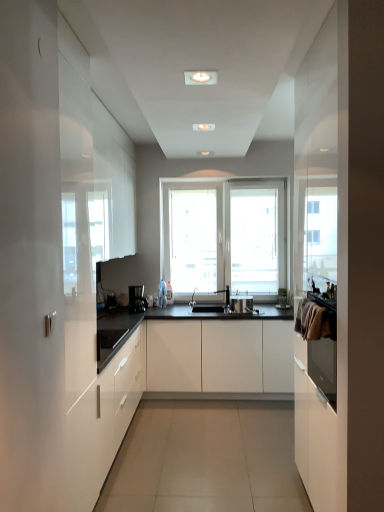
Question: Does satin silver toaster at center appear on the right side of white glossy cabinet at left, marked as the second cabinetry in a right-to-left arrangement?

Choices:
 (A) no
 (B) yes

Answer: (B)

Question: Would you say white glossy cabinet at left, the 1th cabinetry in the left-to-right sequence, is part of satin silver toaster at center's contents?

Choices:
 (A) yes
 (B) no

Answer: (B)

Question: Can you confirm if satin silver toaster at center is taller than white glossy cabinet at left, marked as the second cabinetry in a right-to-left arrangement?

Choices:
 (A) no
 (B) yes

Answer: (A)

Question: Does satin silver toaster at center have a lesser width compared to white glossy cabinet at left, the 1th cabinetry in the left-to-right sequence?

Choices:
 (A) no
 (B) yes

Answer: (B)

Question: Is satin silver toaster at center oriented away from white glossy cabinet at left, marked as the second cabinetry in a right-to-left arrangement?

Choices:
 (A) no
 (B) yes

Answer: (A)

Question: Based on their sizes in the image, would you say white glossy cabinet at left, the 1th cabinetry in the left-to-right sequence, is bigger or smaller than black plastic coffee machine at center?

Choices:
 (A) small
 (B) big

Answer: (B)

Question: Considering the positions of point (84, 398) and point (132, 296), is point (84, 398) closer or farther from the camera than point (132, 296)?

Choices:
 (A) closer
 (B) farther

Answer: (A)

Question: Looking at their shapes, would you say white glossy cabinet at left, marked as the second cabinetry in a right-to-left arrangement, is wider or thinner than black plastic coffee machine at center?

Choices:
 (A) thin
 (B) wide

Answer: (B)

Question: Choose the correct answer: Is white glossy cabinet at left, marked as the second cabinetry in a right-to-left arrangement, inside black plastic coffee machine at center or outside it?

Choices:
 (A) inside
 (B) outside

Answer: (B)

Question: Is satin silver toaster at center situated inside black plastic coffee machine at center or outside?

Choices:
 (A) outside
 (B) inside

Answer: (A)

Question: Considering the positions of satin silver toaster at center and black plastic coffee machine at center in the image, is satin silver toaster at center wider or thinner than black plastic coffee machine at center?

Choices:
 (A) thin
 (B) wide

Answer: (B)

Question: In the image, is satin silver toaster at center on the left side or the right side of black plastic coffee machine at center?

Choices:
 (A) right
 (B) left

Answer: (A)

Question: In the image, is satin silver toaster at center positioned in front of or behind black plastic coffee machine at center?

Choices:
 (A) front
 (B) behind

Answer: (A)

Question: Looking at the image, does satin silver toaster at center seem bigger or smaller compared to white glossy cabinet at left, marked as the second cabinetry in a right-to-left arrangement?

Choices:
 (A) small
 (B) big

Answer: (A)

Question: From a real-world perspective, is satin silver toaster at center positioned above or below white glossy cabinet at left, the 1th cabinetry in the left-to-right sequence?

Choices:
 (A) above
 (B) below

Answer: (A)